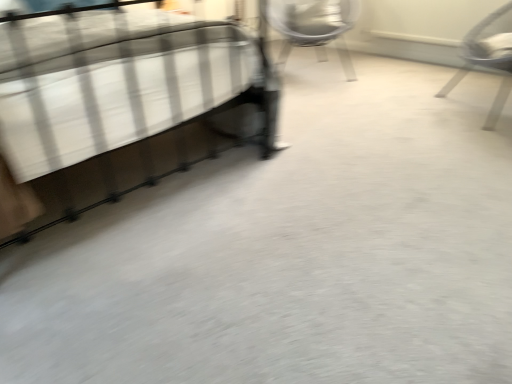
Find the location of a particular element. This screenshot has height=384, width=512. vacant region to the right of metallic silver bed at left is located at coordinates (355, 191).